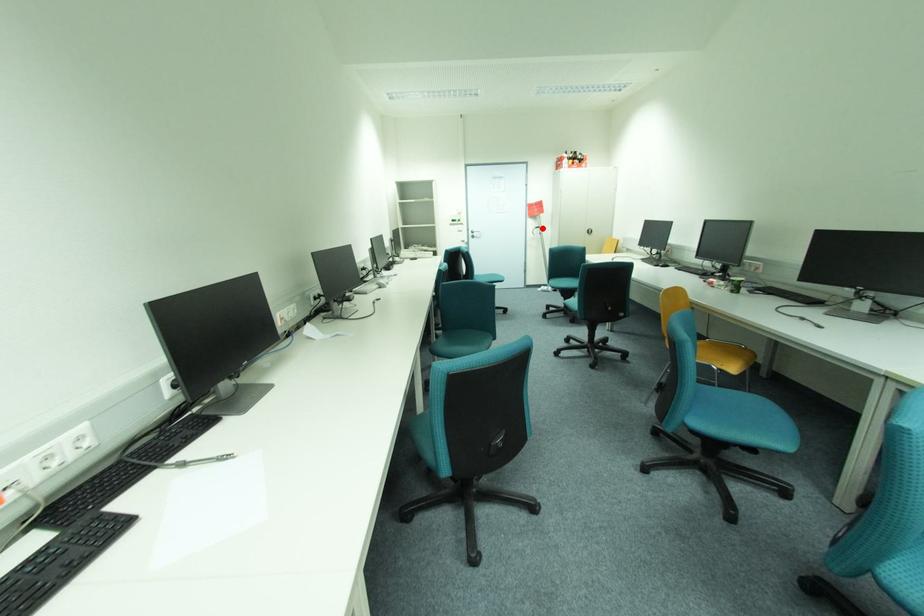
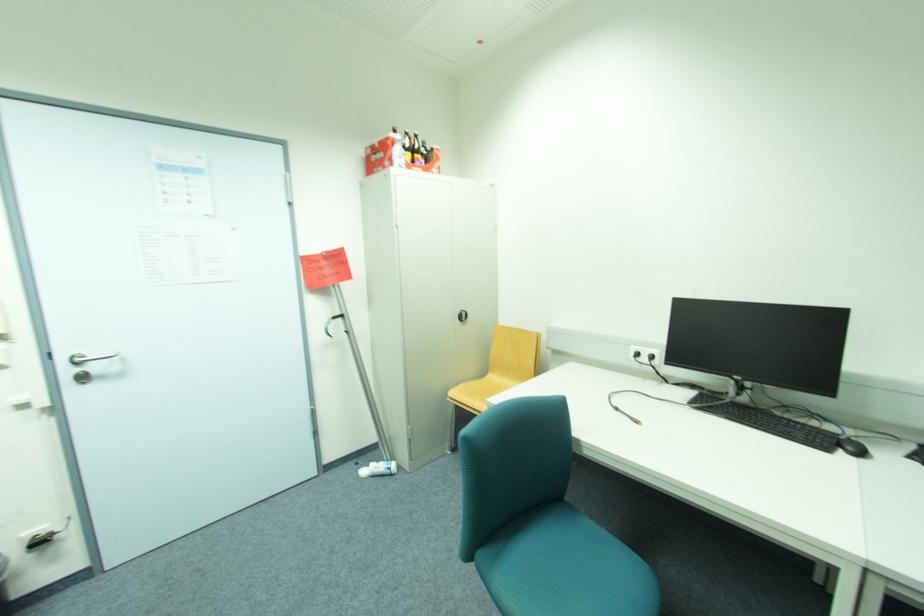
In the second image, find the point that corresponds to the highlighted location in the first image.

(339, 317)